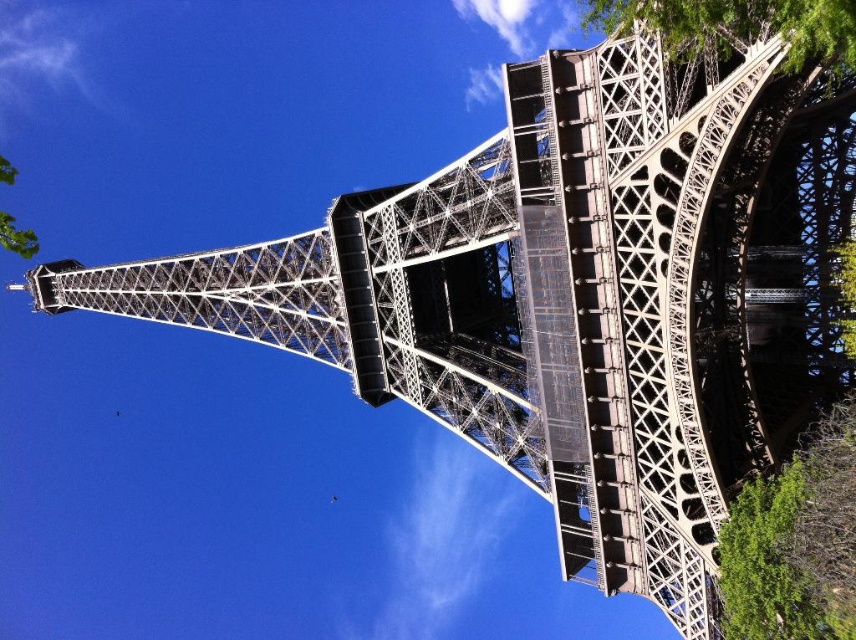
Question: Does green leafy tree at upper right appear on the right side of green leafy tree at lower left?

Choices:
 (A) no
 (B) yes

Answer: (B)

Question: Which of these objects is positioned farthest from the green leafy tree at lower left?

Choices:
 (A) green leafy tree at lower right
 (B) green leafy tree at upper right

Answer: (B)

Question: Does green leafy tree at lower right have a lesser width compared to green leafy tree at lower left?

Choices:
 (A) yes
 (B) no

Answer: (A)

Question: Considering the real-world distances, which object is closest to the green leafy tree at lower left?

Choices:
 (A) green leafy tree at lower right
 (B) green leafy tree at upper right

Answer: (A)

Question: Which point appears closest to the camera in this image?

Choices:
 (A) 22,243
 (B) 800,524
 (C) 805,33

Answer: (C)

Question: Can you confirm if green leafy tree at lower right is positioned above green leafy tree at upper right?

Choices:
 (A) yes
 (B) no

Answer: (B)